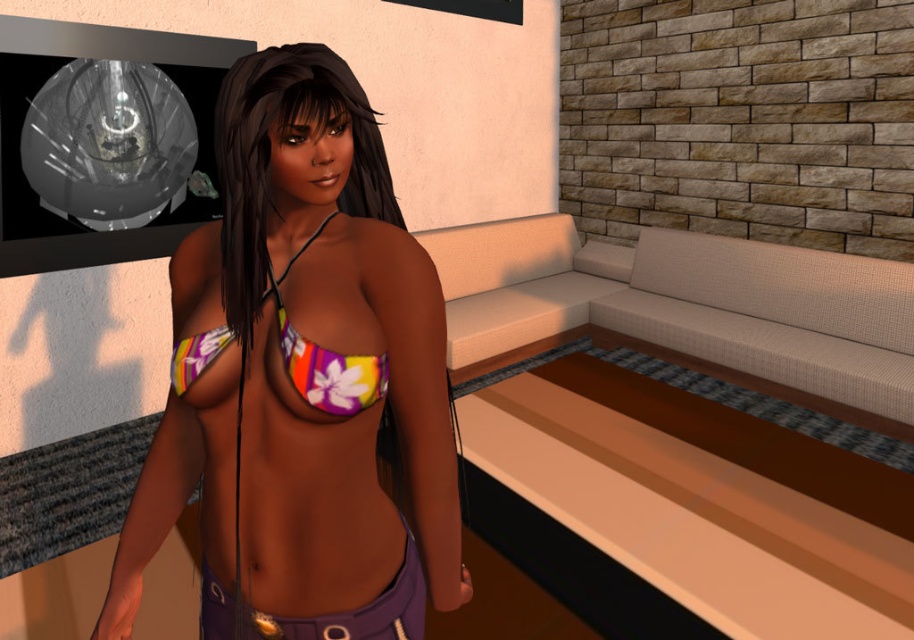
Question: Which object is farther from the camera taking this photo?

Choices:
 (A) black matte hair at center
 (B) purple fabric shorts at lower center
 (C) multicolored fabric bikini top at center
 (D) floral fabric bikini top at center

Answer: (B)

Question: Which object is closer to the camera taking this photo?

Choices:
 (A) multicolored fabric bikini top at center
 (B) floral fabric bikini top at center
 (C) purple fabric shorts at lower center

Answer: (B)

Question: Which point appears farthest from the camera in this image?

Choices:
 (A) (283, 605)
 (B) (367, 132)

Answer: (B)

Question: Is the position of black matte hair at center less distant than that of purple fabric shorts at lower center?

Choices:
 (A) yes
 (B) no

Answer: (A)

Question: Does black matte hair at center appear over purple fabric shorts at lower center?

Choices:
 (A) yes
 (B) no

Answer: (A)

Question: Is multicolored fabric bikini top at center to the right of purple fabric shorts at lower center from the viewer's perspective?

Choices:
 (A) no
 (B) yes

Answer: (A)